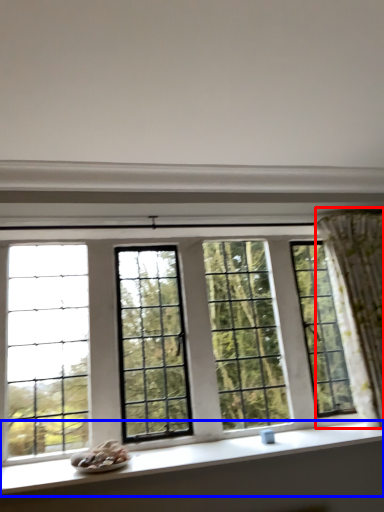
Question: Which point is closer to the camera, curtain (highlighted by a red box) or window sill (highlighted by a blue box)?

Choices:
 (A) curtain
 (B) window sill

Answer: (B)